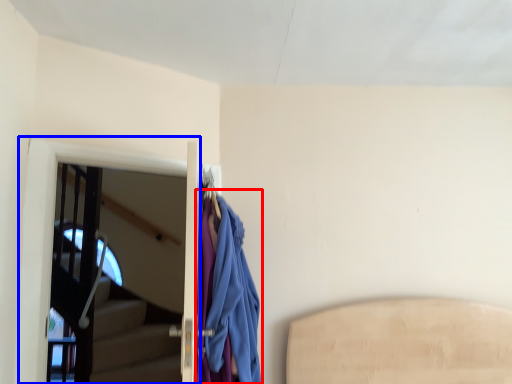
Question: Among these objects, which one is nearest to the camera, cloak (highlighted by a red box) or screen door (highlighted by a blue box)?

Choices:
 (A) cloak
 (B) screen door

Answer: (A)